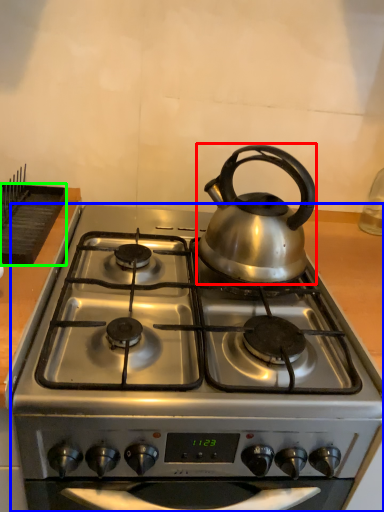
Question: Which is farther away from kettle (highlighted by a red box)? gas stove (highlighted by a blue box) or kitchen appliance (highlighted by a green box)?

Choices:
 (A) gas stove
 (B) kitchen appliance

Answer: (B)